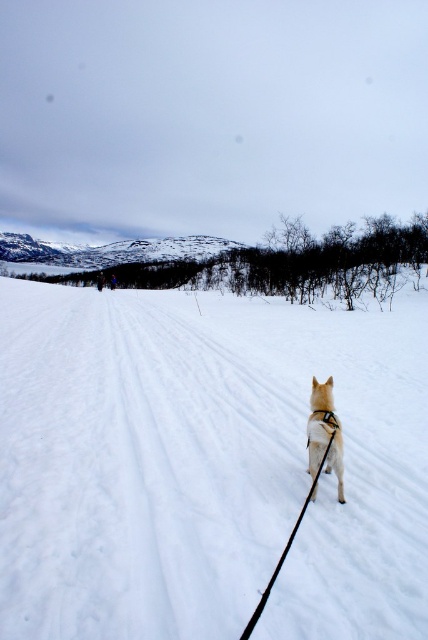
Which is behind, point (6, 522) or point (317, 444)?

Point (317, 444)

Measure the distance between point (44, 291) and camera.

The distance of point (44, 291) from camera is 40.67 meters.

Identify the location of white fluffy snow at center. (207, 467).

This screenshot has width=428, height=640. In order to click on white fluffy snow at center in this screenshot , I will do `click(207, 467)`.